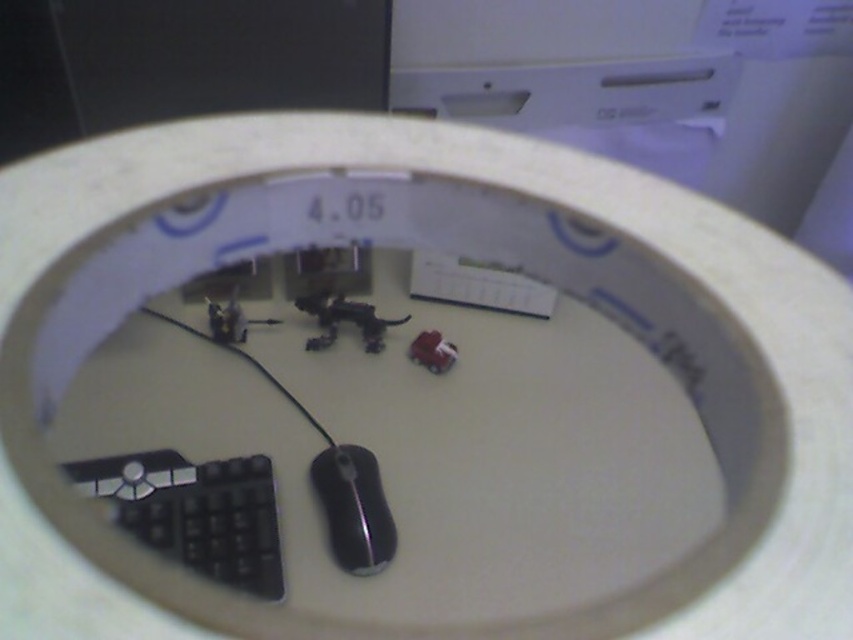
You are organizing your desk and need to move the black glossy mouse at center to the right side. However, there is a black matte keyboard at lower left blocking the path. Can you move the mouse without moving the keyboard first?

The black matte keyboard at lower left is in front of the black glossy mouse at center, so you need to move the keyboard first to access the mouse.

You are organizing items on a desk and see the black glossy mouse at center and the matte plastic toy car at center. Which item is closer to you?

The matte plastic toy car at center is closer to you because the black glossy mouse at center is positioned under it.